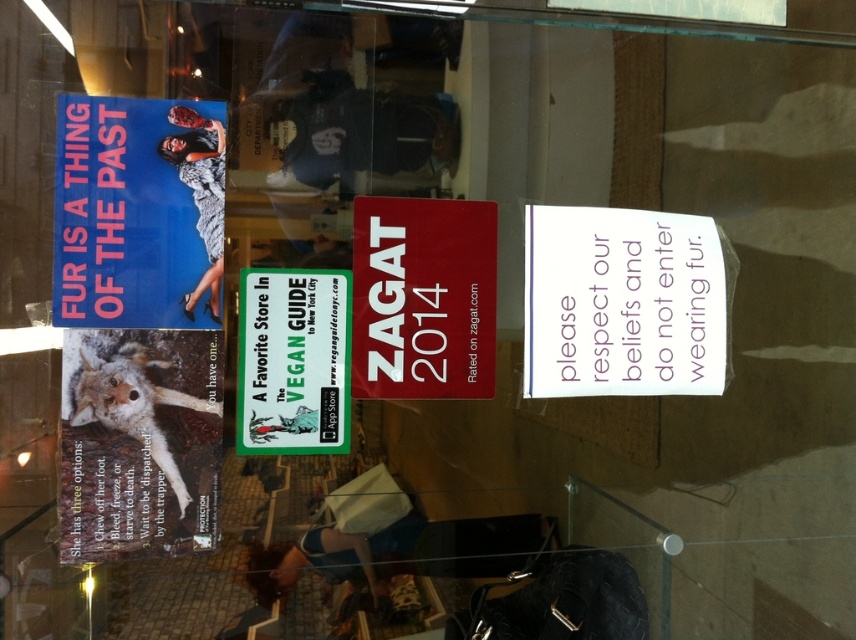
Based on the scene description, which sign is positioned higher between the matte red sign at center and the green paper sign at center?

The matte red sign at center is positioned higher than the green paper sign at center.

You are standing in front of the glass storefront window and see the matte red sign at center and the green paper sign at center. Which one appears closer to you?

The matte red sign at center is closer to you because it is further to the viewer than the green paper sign at center.